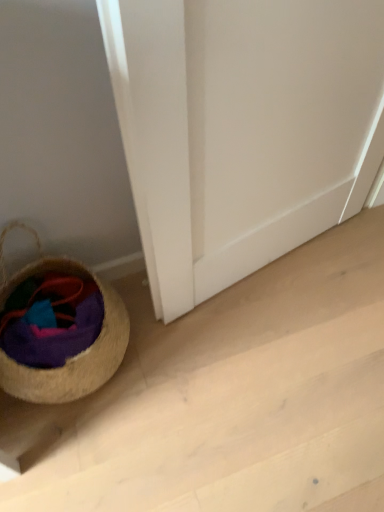
What do you see at coordinates (59, 332) in the screenshot? I see `beige woven basket at lower left` at bounding box center [59, 332].

The height and width of the screenshot is (512, 384). I want to click on beige woven basket at lower left, so click(x=59, y=332).

This screenshot has width=384, height=512. In order to click on beige woven basket at lower left in this screenshot , I will do `click(59, 332)`.